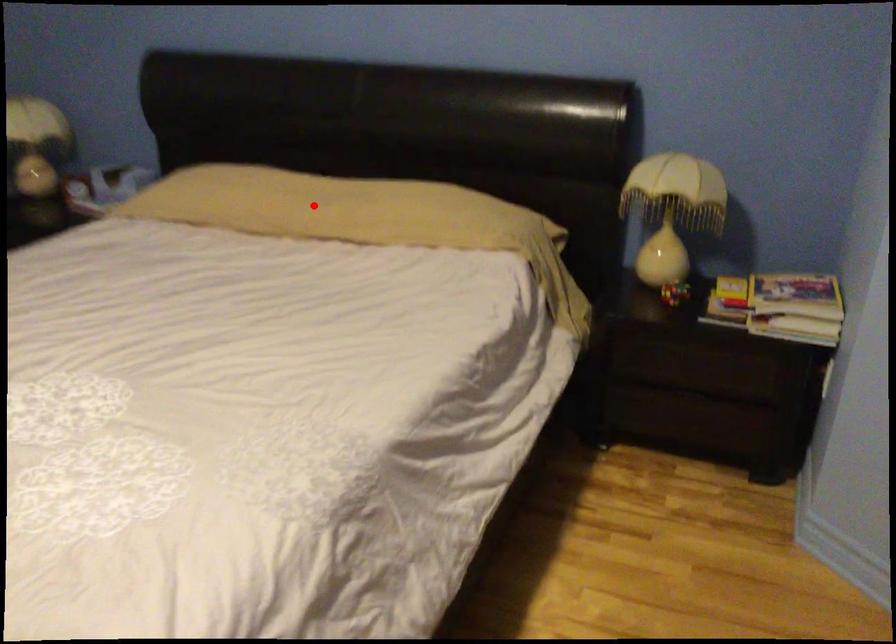
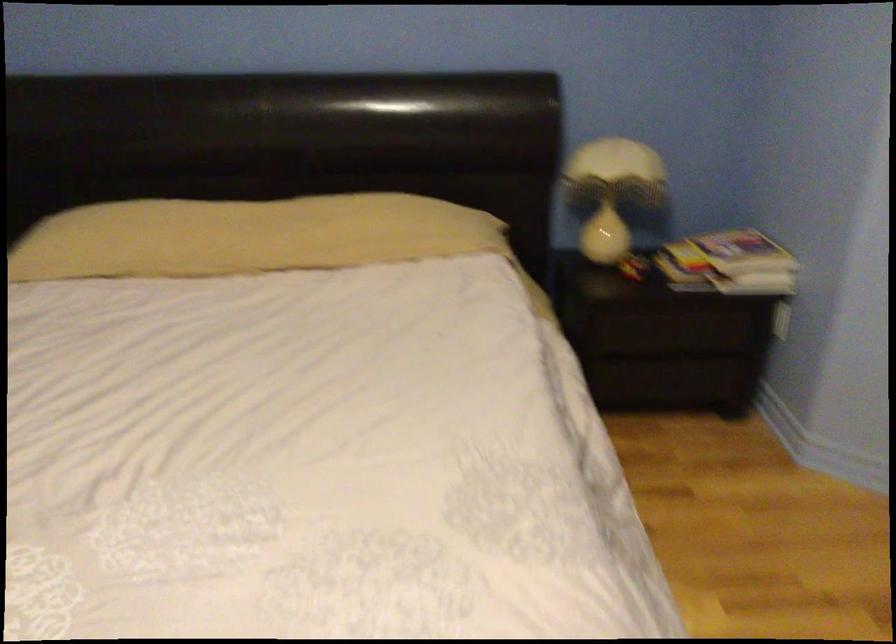
Question: I am providing you with two images of the same scene from different viewpoints. A red point is shown in image1. For the corresponding object point in image2, is it positioned nearer or farther from the camera?

Choices:
 (A) Nearer
 (B) Farther

Answer: (A)